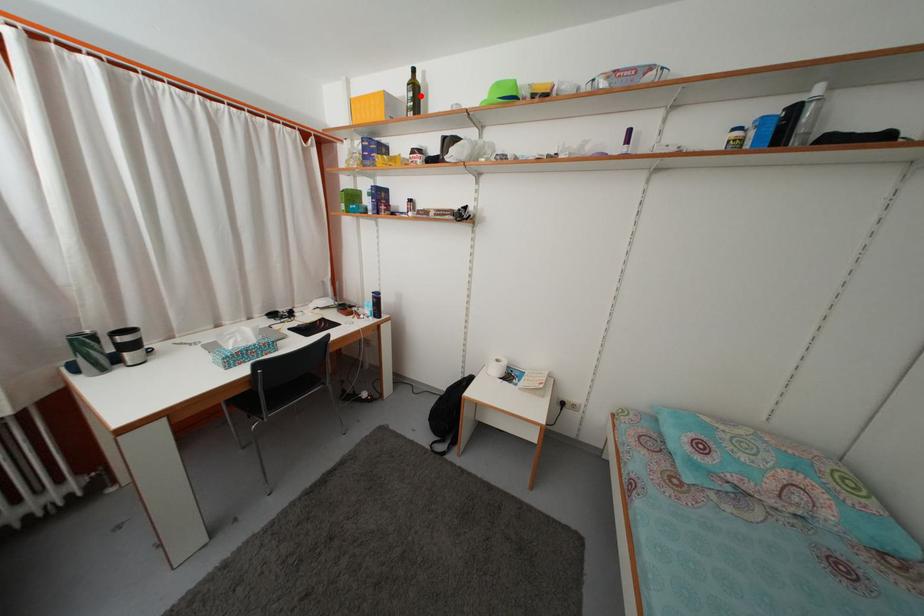
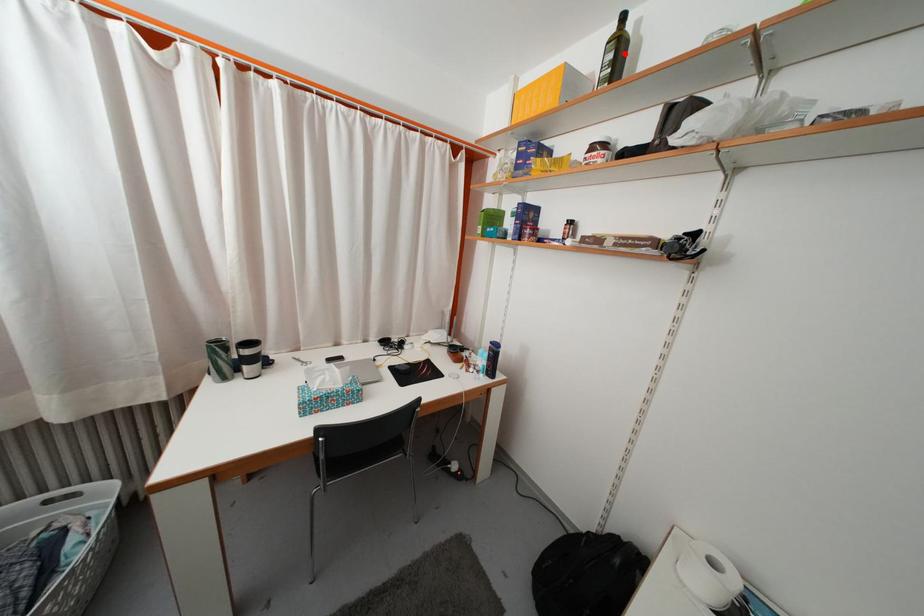
I am providing you with two images of the same scene from different viewpoints. A red point is marked on the first image and another point is marked on the second image. Is the red point in image1 aligned with the point shown in image2?

Yes